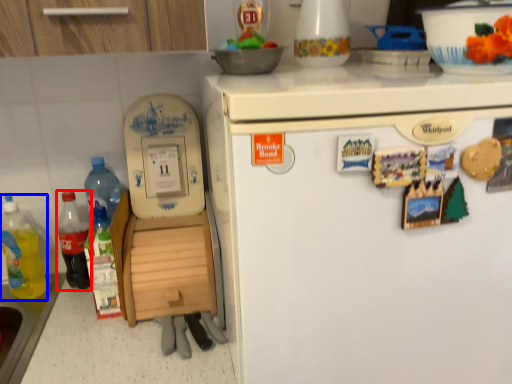
Question: Which object appears farthest to the camera in this image, bottle (highlighted by a red box) or bottle (highlighted by a blue box)?

Choices:
 (A) bottle
 (B) bottle

Answer: (A)